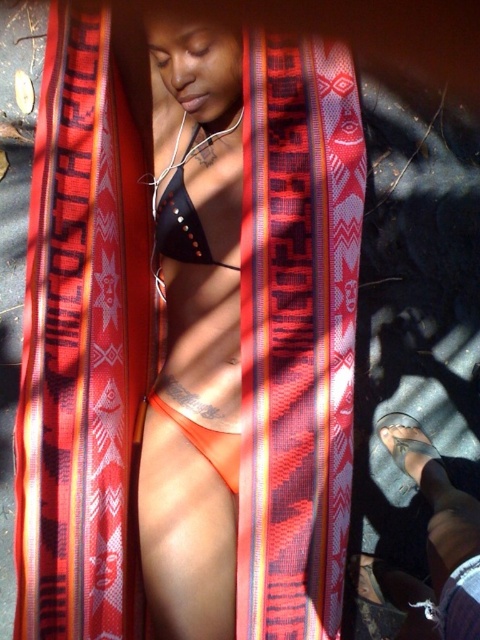
Question: Is orange fabric bikini bottom at center to the right of black studded bikini top at center from the viewer's perspective?

Choices:
 (A) yes
 (B) no

Answer: (A)

Question: Among these objects, which one is nearest to the camera?

Choices:
 (A) orange fabric bikini bottom at center
 (B) orange matte bikini at center
 (C) black studded bikini top at center

Answer: (A)

Question: Which object appears closest to the camera in this image?

Choices:
 (A) black studded bikini top at center
 (B) orange fabric bikini bottom at center
 (C) orange matte bikini at center

Answer: (B)

Question: Considering the relative positions of orange fabric bikini bottom at center and orange matte bikini at center in the image provided, where is orange fabric bikini bottom at center located with respect to orange matte bikini at center?

Choices:
 (A) below
 (B) above

Answer: (B)

Question: Among these points, which one is farthest from the camera?

Choices:
 (A) (207, 348)
 (B) (187, 209)

Answer: (A)

Question: Does black studded bikini top at center appear on the left side of orange matte bikini at center?

Choices:
 (A) no
 (B) yes

Answer: (B)